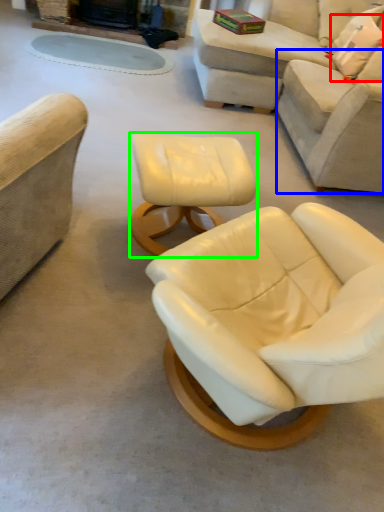
Question: Based on their relative distances, which object is nearer to pillow (highlighted by a red box)? Choose from couch (highlighted by a blue box) and table (highlighted by a green box).

Choices:
 (A) couch
 (B) table

Answer: (A)